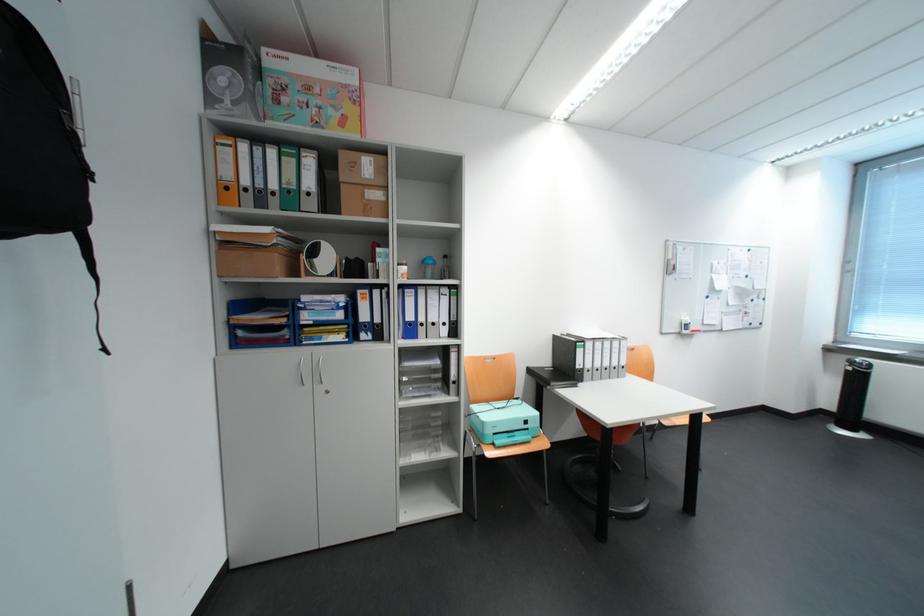
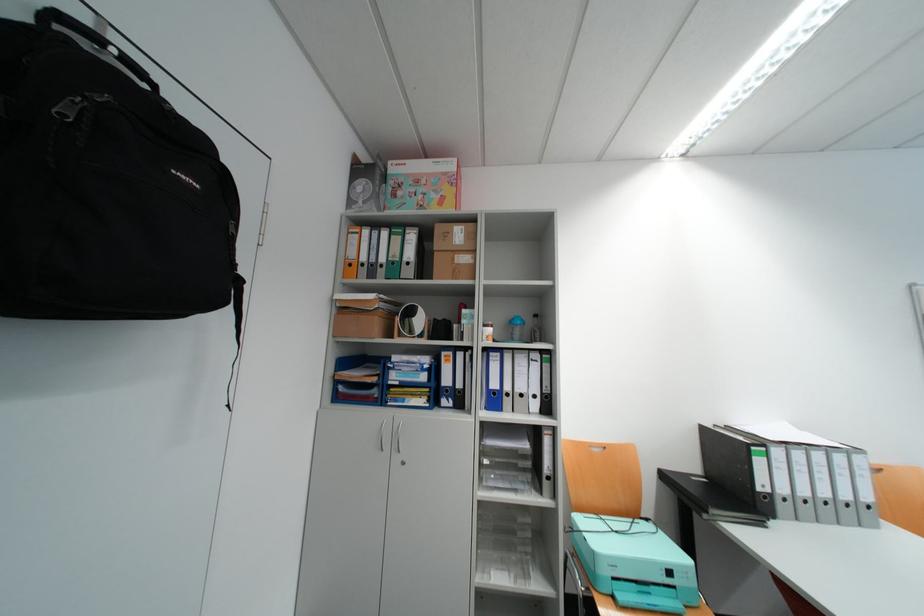
Find the pixel in the second image that matches the point at 432,270 in the first image.

(518, 330)